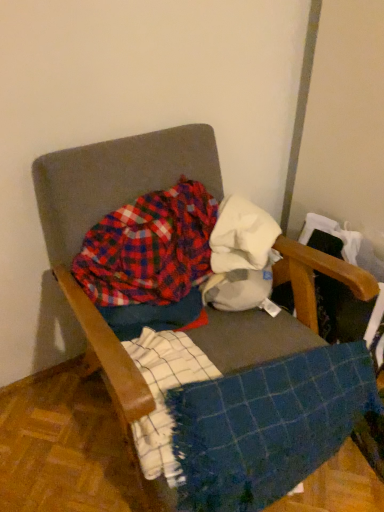
Question: Considering the relative positions of textured fabric chair at center and blue woven blanket at center in the image provided, is textured fabric chair at center to the left of blue woven blanket at center from the viewer's perspective?

Choices:
 (A) no
 (B) yes

Answer: (B)

Question: From the image's perspective, is textured fabric chair at center on top of blue woven blanket at center?

Choices:
 (A) yes
 (B) no

Answer: (A)

Question: From a real-world perspective, does textured fabric chair at center stand above blue woven blanket at center?

Choices:
 (A) yes
 (B) no

Answer: (A)

Question: Considering the relative sizes of textured fabric chair at center and blue woven blanket at center in the image provided, is textured fabric chair at center taller than blue woven blanket at center?

Choices:
 (A) no
 (B) yes

Answer: (B)

Question: Is textured fabric chair at center positioned beyond the bounds of blue woven blanket at center?

Choices:
 (A) no
 (B) yes

Answer: (B)

Question: Does textured fabric chair at center have a smaller size compared to blue woven blanket at center?

Choices:
 (A) no
 (B) yes

Answer: (A)

Question: Is white cotton cloth at center positioned before textured fabric chair at center?

Choices:
 (A) yes
 (B) no

Answer: (B)

Question: From the image's perspective, would you say white cotton cloth at center is positioned over textured fabric chair at center?

Choices:
 (A) yes
 (B) no

Answer: (A)

Question: From a real-world perspective, is white cotton cloth at center over textured fabric chair at center?

Choices:
 (A) no
 (B) yes

Answer: (B)

Question: Does white cotton cloth at center have a greater height compared to textured fabric chair at center?

Choices:
 (A) yes
 (B) no

Answer: (B)

Question: From the image's perspective, would you say white cotton cloth at center is shown under textured fabric chair at center?

Choices:
 (A) yes
 (B) no

Answer: (B)

Question: Is white cotton cloth at center with textured fabric chair at center?

Choices:
 (A) yes
 (B) no

Answer: (B)

Question: Is white cotton cloth at center completely or partially inside plaid cotton shirt at center?

Choices:
 (A) yes
 (B) no

Answer: (B)